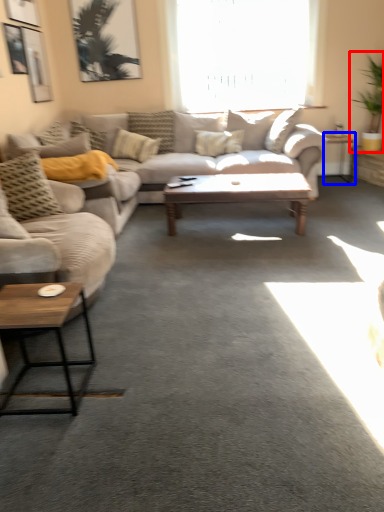
Question: Among these objects, which one is farthest to the camera, houseplant (highlighted by a red box) or table (highlighted by a blue box)?

Choices:
 (A) houseplant
 (B) table

Answer: (B)